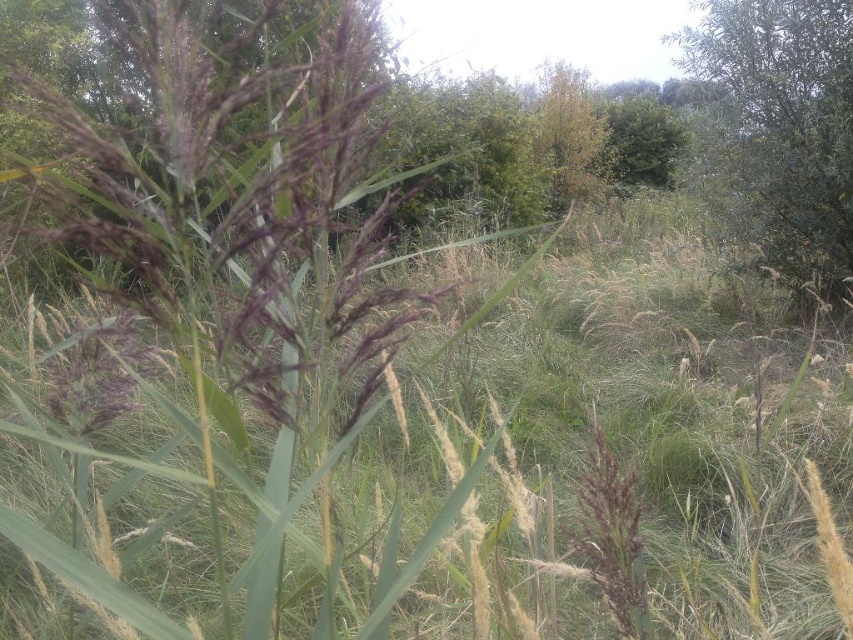
You are a photographer trying to capture a closeup of the purple matte grass at center and the green leafy tree at upper right in the same frame. Based on their positions, which object should you adjust your camera focus to first to ensure both are in the frame?

The purple matte grass at center is positioned on the left side of green leafy tree at upper right. To include both in the frame, adjust focus starting with the purple matte grass at center since it is closer to the foreground, then adjust to include the green leafy tree at upper right in the background.

You are a botanist examining the image of a meadow. You notice the purple matte grass at center and the green leafy tree at upper right. Which of these two plants is smaller in size?

The purple matte grass at center has a smaller size compared to the green leafy tree at upper right, so the purple matte grass at center is smaller.

You are a photographer trying to capture the purple matte grass at center and the green leafy tree at upper right in a single frame. Based on their positions, which object is closer to the camera?

The purple matte grass at center is positioned under the green leafy tree at upper right, meaning it is closer to the camera.